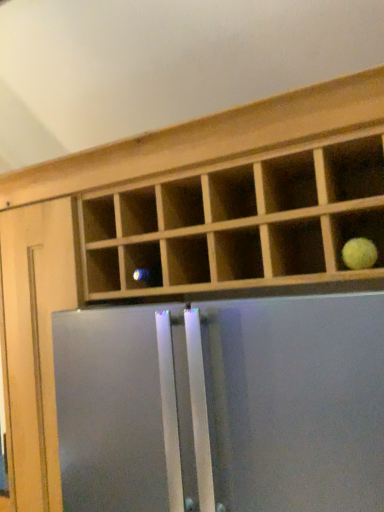
Question: Should I look upward or downward to see yellow matte tennis ball at upper right?

Choices:
 (A) down
 (B) up

Answer: (A)

Question: Considering the relative sizes of yellow matte tennis ball at upper right and satin silver refrigerator at center in the image provided, is yellow matte tennis ball at upper right thinner than satin silver refrigerator at center?

Choices:
 (A) yes
 (B) no

Answer: (A)

Question: Is yellow matte tennis ball at upper right not close to satin silver refrigerator at center?

Choices:
 (A) no
 (B) yes

Answer: (A)

Question: From a real-world perspective, is yellow matte tennis ball at upper right located beneath satin silver refrigerator at center?

Choices:
 (A) no
 (B) yes

Answer: (A)

Question: Considering the relative sizes of yellow matte tennis ball at upper right and satin silver refrigerator at center in the image provided, is yellow matte tennis ball at upper right smaller than satin silver refrigerator at center?

Choices:
 (A) yes
 (B) no

Answer: (A)

Question: From the image's perspective, is yellow matte tennis ball at upper right over satin silver refrigerator at center?

Choices:
 (A) no
 (B) yes

Answer: (B)

Question: Considering the relative sizes of yellow matte tennis ball at upper right and satin silver refrigerator at center in the image provided, is yellow matte tennis ball at upper right shorter than satin silver refrigerator at center?

Choices:
 (A) yes
 (B) no

Answer: (A)

Question: Considering the relative positions of satin silver refrigerator at center and yellow matte tennis ball at upper right in the image provided, is satin silver refrigerator at center to the right of yellow matte tennis ball at upper right from the viewer's perspective?

Choices:
 (A) yes
 (B) no

Answer: (B)

Question: Is satin silver refrigerator at center facing away from yellow matte tennis ball at upper right?

Choices:
 (A) yes
 (B) no

Answer: (B)

Question: Can you confirm if satin silver refrigerator at center is wider than yellow matte tennis ball at upper right?

Choices:
 (A) no
 (B) yes

Answer: (B)

Question: From a real-world perspective, is satin silver refrigerator at center located beneath yellow matte tennis ball at upper right?

Choices:
 (A) yes
 (B) no

Answer: (A)

Question: Does satin silver refrigerator at center lie in front of yellow matte tennis ball at upper right?

Choices:
 (A) yes
 (B) no

Answer: (A)

Question: Does satin silver refrigerator at center have a larger size compared to yellow matte tennis ball at upper right?

Choices:
 (A) yes
 (B) no

Answer: (A)

Question: Considering the positions of yellow matte tennis ball at upper right and satin silver refrigerator at center in the image, is yellow matte tennis ball at upper right bigger or smaller than satin silver refrigerator at center?

Choices:
 (A) small
 (B) big

Answer: (A)